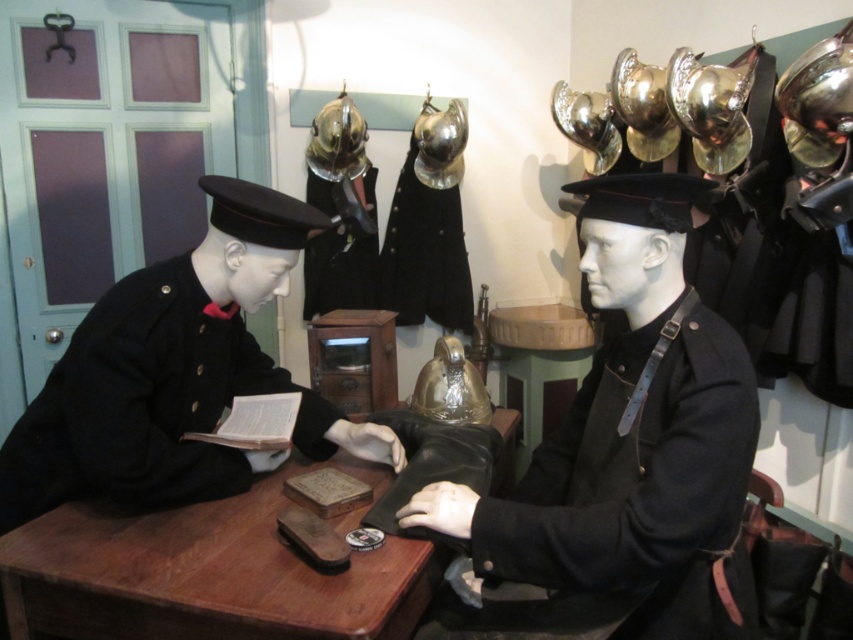
Between point (80, 436) and point (346, 93), which one is positioned in front?

Point (80, 436)

Based on the photo, between black woolen uniform at left and metallic gold helmet at upper center, which one has less height?

Standing shorter between the two is metallic gold helmet at upper center.

Where is `black woolen uniform at left`? black woolen uniform at left is located at coordinates (144, 403).

Is black woolen jacket at center behind black woolen uniform at left?

No, it is not.

Does black woolen jacket at center appear on the right side of black woolen uniform at left?

Indeed, black woolen jacket at center is positioned on the right side of black woolen uniform at left.

The height and width of the screenshot is (640, 853). What do you see at coordinates (627, 499) in the screenshot?
I see `black woolen jacket at center` at bounding box center [627, 499].

Identify the location of black woolen jacket at center. (627, 499).

Can you confirm if black woolen uniform at left is bigger than shiny metallic helmet at center?

Yes.

In the scene shown: Which is more to the right, black woolen uniform at left or shiny metallic helmet at center?

shiny metallic helmet at center

Who is more forward, (323, 419) or (432, 250)?

Positioned in front is point (323, 419).

The width and height of the screenshot is (853, 640). I want to click on black woolen uniform at left, so click(144, 403).